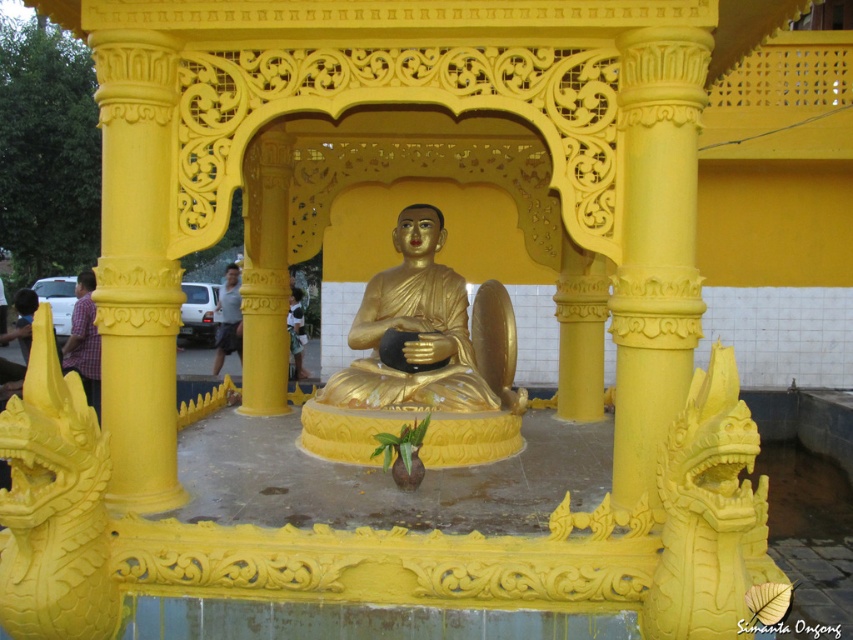
Can you confirm if gold polished statue at center is thinner than matte gray shirt at center?

Incorrect, gold polished statue at center's width is not less than matte gray shirt at center's.

Who is lower down, gold polished statue at center or matte gray shirt at center?

gold polished statue at center is lower down.

Which is in front, point (381, 371) or point (223, 353)?

Point (381, 371) is more forward.

At what (x,y) coordinates should I click in order to perform the action: click on gold polished statue at center. Please return your answer as a coordinate pair (x, y). This screenshot has height=640, width=853. Looking at the image, I should click on (413, 330).

Does matte yellow column at center lie in front of plaid shirt at left?

Yes.

Who is more distant from viewer, (627,262) or (93,396)?

Point (93,396)

Identify the location of matte yellow column at center. (654, 248).

Between matte yellow column at center and matte gray shirt at center, which one appears on the left side from the viewer's perspective?

From the viewer's perspective, matte gray shirt at center appears more on the left side.

Does point (660, 435) come closer to viewer compared to point (235, 348)?

Yes, point (660, 435) is in front of point (235, 348).

Describe the element at coordinates (654, 248) in the screenshot. I see `matte yellow column at center` at that location.

Identify the location of matte yellow column at center. The height and width of the screenshot is (640, 853). coord(654,248).